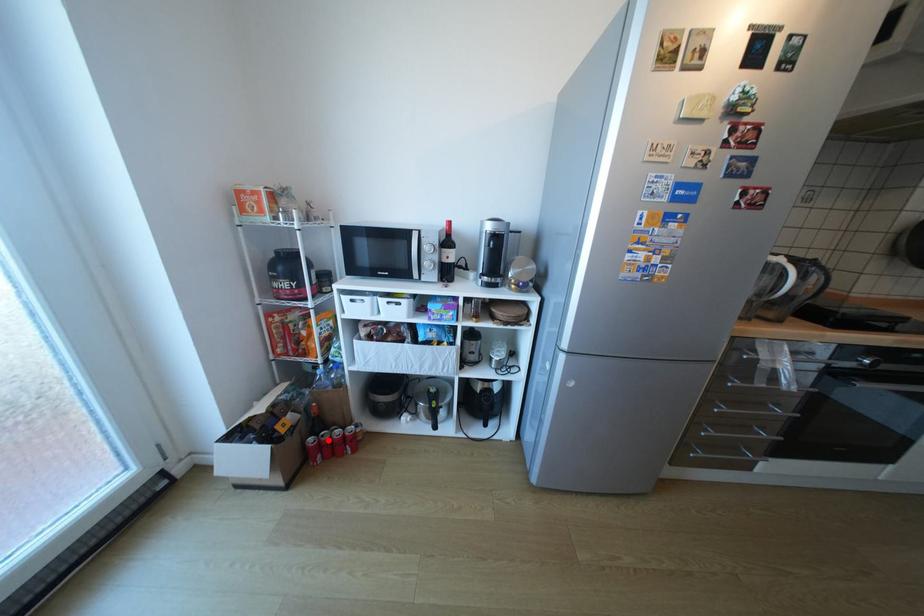
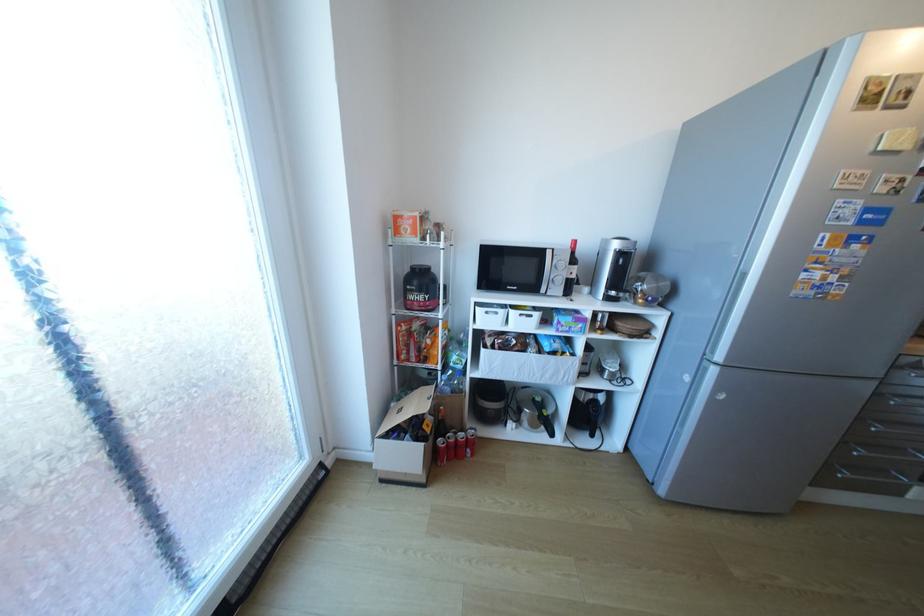
Where in the second image is the point corresponding to the highlighted location from the first image?

(456, 442)